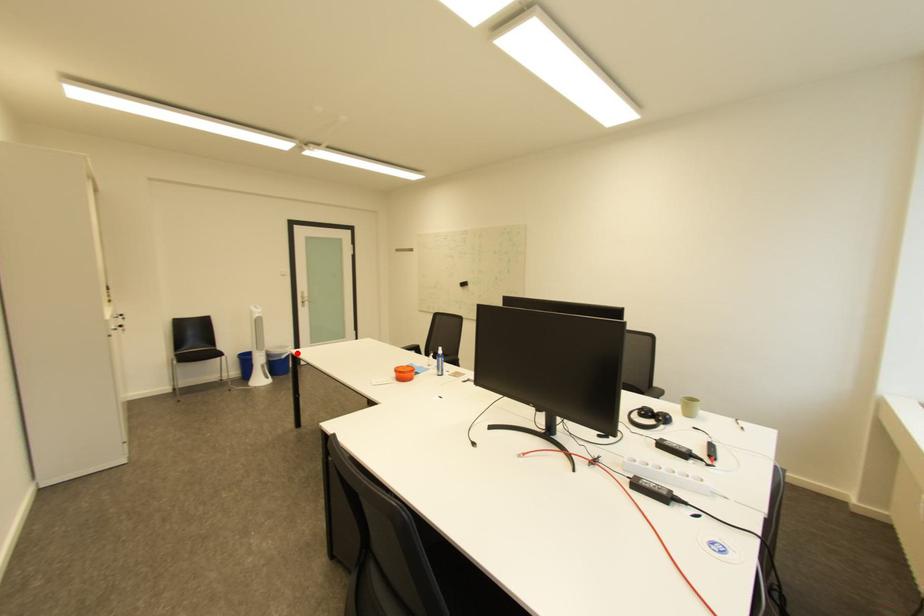
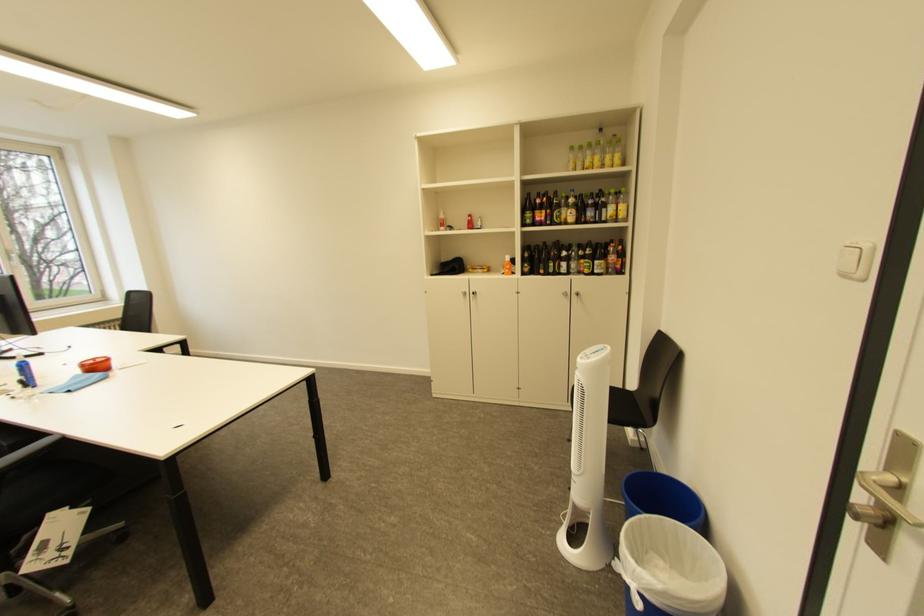
Find the pixel in the second image that matches the highlighted location in the first image.

(636, 570)